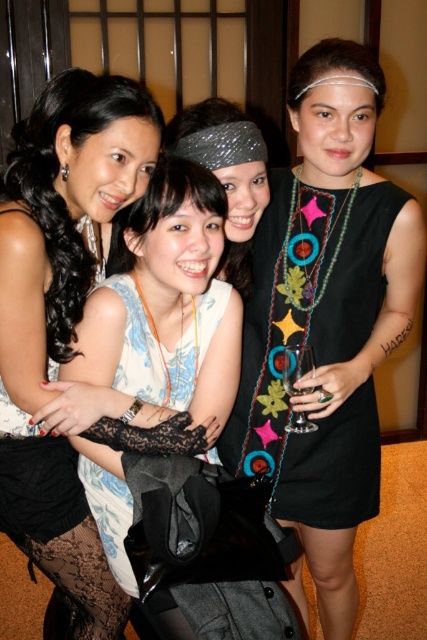
Question: Is black fabric dress at center positioned in front of white lace dress at center?

Choices:
 (A) yes
 (B) no

Answer: (B)

Question: Can you confirm if matte black dress at center is positioned to the right of clear glass wine glass at center?

Choices:
 (A) no
 (B) yes

Answer: (A)

Question: Which of the following is the farthest from the observer?

Choices:
 (A) clear glass wine glass at center
 (B) white lace dress at center

Answer: (A)

Question: Does matte black dress at center have a smaller size compared to black fabric dress at center?

Choices:
 (A) no
 (B) yes

Answer: (A)

Question: Which point is farther to the camera?

Choices:
 (A) (335, 436)
 (B) (5, 268)
 (C) (284, 376)

Answer: (A)

Question: Which object is the farthest from the black fabric dress at center?

Choices:
 (A) white lace dress at center
 (B) clear glass wine glass at center
 (C) matte black dress at center

Answer: (C)